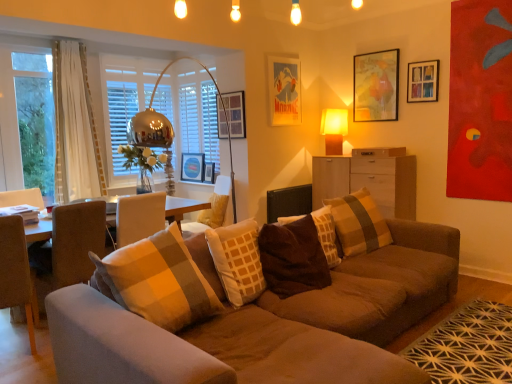
Locate an element on the screen. light brown wood cabinet at center right is located at coordinates (368, 181).

Describe the element at coordinates (284, 90) in the screenshot. This screenshot has width=512, height=384. I see `matte paper poster at upper center, arranged as the 4th picture frame when viewed from the left` at that location.

Locate an element on the screen. wooden map at upper right, acting as the 2th picture frame starting from the right is located at coordinates (376, 86).

What do you see at coordinates (27, 121) in the screenshot? The width and height of the screenshot is (512, 384). I see `transparent glass window at left` at bounding box center [27, 121].

Locate an element on the screen. light brown wood cabinet at center right is located at coordinates (368, 181).

Which is more to the left, wooden picture frame at upper right, the sixth picture frame when ordered from left to right, or brown fabric swivel chair at left?

Positioned to the left is brown fabric swivel chair at left.

Looking at this image, how far apart are wooden picture frame at upper right, the sixth picture frame when ordered from left to right, and brown fabric swivel chair at left?

The distance of wooden picture frame at upper right, the sixth picture frame when ordered from left to right, from brown fabric swivel chair at left is 11.20 feet.

From a real-world perspective, is wooden picture frame at upper right, the sixth picture frame when ordered from left to right, located higher than brown fabric swivel chair at left?

Yes.

Does wooden picture frame at upper right, the sixth picture frame when ordered from left to right, come behind brown fabric swivel chair at left?

Yes, it is behind brown fabric swivel chair at left.

Would you say wooden map at upper right, acting as the fifth picture frame starting from the left, is outside white sheer curtain at left?

Yes, wooden map at upper right, acting as the fifth picture frame starting from the left, is outside of white sheer curtain at left.

Which of these two, wooden map at upper right, acting as the fifth picture frame starting from the left, or white sheer curtain at left, stands taller?

white sheer curtain at left is taller.

From a real-world perspective, which picture frame is the 4th one above the white sheer curtain at left? Please provide its 2D coordinates.

[(376, 86)]

Is wooden map at upper right, acting as the fifth picture frame starting from the left, beside white sheer curtain at left?

No, wooden map at upper right, acting as the fifth picture frame starting from the left, is not with white sheer curtain at left.

Would you say light brown wood cabinet at center right is a long distance from transparent glass window at left?

Indeed, light brown wood cabinet at center right is not near transparent glass window at left.

Which of these two, light brown wood cabinet at center right or transparent glass window at left, stands taller?

transparent glass window at left.

From the image's perspective, is light brown wood cabinet at center right under transparent glass window at left?

Indeed, from the image's perspective, light brown wood cabinet at center right is shown beneath transparent glass window at left.

Is wooden map at upper right, acting as the fifth picture frame starting from the left, shorter than plaid fabric pillow at center, the third pillow viewed from the front?

In fact, wooden map at upper right, acting as the fifth picture frame starting from the left, may be taller than plaid fabric pillow at center, the third pillow viewed from the front.

Is wooden map at upper right, acting as the fifth picture frame starting from the left, looking in the opposite direction of plaid fabric pillow at center, the 1th pillow viewed from the back?

No, wooden map at upper right, acting as the fifth picture frame starting from the left, is not facing the opposite direction of plaid fabric pillow at center, the 1th pillow viewed from the back.

In terms of width, does wooden map at upper right, acting as the 2th picture frame starting from the right, look wider or thinner when compared to plaid fabric pillow at center, the third pillow viewed from the front?

Considering their sizes, wooden map at upper right, acting as the 2th picture frame starting from the right, looks slimmer than plaid fabric pillow at center, the third pillow viewed from the front.

Is point (362, 74) in front of point (364, 211)?

No, (362, 74) is further to viewer.

From a real-world perspective, who is located higher, beige fabric armchair at center or matte paper poster at upper center, which appears as the 3th picture frame when viewed from the right?

From a 3D spatial view, matte paper poster at upper center, which appears as the 3th picture frame when viewed from the right, is above.

Does beige fabric armchair at center have a larger size compared to matte paper poster at upper center, arranged as the 4th picture frame when viewed from the left?

Correct, beige fabric armchair at center is larger in size than matte paper poster at upper center, arranged as the 4th picture frame when viewed from the left.

Can you tell me how much beige fabric armchair at center and matte paper poster at upper center, arranged as the 4th picture frame when viewed from the left, differ in facing direction?

The facing directions of beige fabric armchair at center and matte paper poster at upper center, arranged as the 4th picture frame when viewed from the left, are 100 degrees apart.

Which object is closer to the camera taking this photo, beige fabric armchair at center or matte paper poster at upper center, which appears as the 3th picture frame when viewed from the right?

beige fabric armchair at center is in front.

Looking at the image, does matte orange table lamp at upper right seem bigger or smaller compared to plaid fabric pillow at center, the third pillow viewed from the front?

matte orange table lamp at upper right is smaller than plaid fabric pillow at center, the third pillow viewed from the front.

From a real-world perspective, who is located higher, matte orange table lamp at upper right or plaid fabric pillow at center, the third pillow viewed from the front?

matte orange table lamp at upper right.

Which object is closer to the camera, matte orange table lamp at upper right or plaid fabric pillow at center, the third pillow viewed from the front?

plaid fabric pillow at center, the third pillow viewed from the front, is in front.

From a real-world perspective, is matte paper poster at upper center, which appears as the 3th picture frame when viewed from the right, below white sheer curtain at left?

Actually, matte paper poster at upper center, which appears as the 3th picture frame when viewed from the right, is physically above white sheer curtain at left in the real world.

Is matte paper poster at upper center, which appears as the 3th picture frame when viewed from the right, positioned with its back to white sheer curtain at left?

No, white sheer curtain at left is not at the back of matte paper poster at upper center, which appears as the 3th picture frame when viewed from the right.

Which of these two, matte paper poster at upper center, arranged as the 4th picture frame when viewed from the left, or white sheer curtain at left, is bigger?

Bigger between the two is white sheer curtain at left.

From the image's perspective, who appears lower, matte paper poster at upper center, which appears as the 3th picture frame when viewed from the right, or white sheer curtain at left?

white sheer curtain at left is shown below in the image.

Identify the location of swivel chair lying below the wooden picture frame at upper right, the sixth picture frame when ordered from left to right (from the image's perspective). (69, 248).

This screenshot has width=512, height=384. Identify the location of picture frame that is the 5th object to the right of the white sheer curtain at left, starting at the anchor. [x=376, y=86].

Considering their positions, is beige fabric armchair at center positioned closer to light brown wood chair at left than metallic glass vase at left?

beige fabric armchair at center lies closer to light brown wood chair at left than the other object.

From the image, which object appears to be farther from beige fabric armchair at center, wooden map at upper right, acting as the fifth picture frame starting from the left, or wooden picture frame at upper center, marked as the 3th picture frame in a left-to-right arrangement?

wooden map at upper right, acting as the fifth picture frame starting from the left, is positioned further to the anchor beige fabric armchair at center.

Based on their spatial positions, is yellow glass lightbulbs at upper center or light brown wood chair at left closer to brownplush fabricpillow at center, which appears as the 2th pillow when viewed from the back?

Among the two, light brown wood chair at left is located nearer to brownplush fabricpillow at center, which appears as the 2th pillow when viewed from the back.

From the image, which object appears to be nearer to brownplush fabricpillow at center, which appears as the 2th pillow when viewed from the back, light brown wood chair at left or plaid fabric pillow at center, the third pillow viewed from the front?

plaid fabric pillow at center, the third pillow viewed from the front.

Considering their positions, is suede couch at center positioned closer to white wood drawer at center than wooden picture frame at upper center, marked as the 3th picture frame in a left-to-right arrangement?

Among the two, wooden picture frame at upper center, marked as the 3th picture frame in a left-to-right arrangement, is located nearer to white wood drawer at center.

Considering their positions, is brown fabric swivel chair at left positioned further to brownplush fabricpillow at center, which appears as the 2th pillow when viewed from the back, than wooden map at upper right, acting as the 2th picture frame starting from the right?

Based on the image, wooden map at upper right, acting as the 2th picture frame starting from the right, appears to be further to brownplush fabricpillow at center, which appears as the 2th pillow when viewed from the back.

From the picture: Estimate the real-world distances between objects in this image. Which object is further from beige fabric armchair at center, plaid fabric pillow at center, the 1th pillow viewed from the back, or white wood drawer at center?

white wood drawer at center lies further to beige fabric armchair at center than the other object.

Estimate the real-world distances between objects in this image. Which object is closer to brown fabric swivel chair at left, beige fabric armchair at center or matte orange table lamp at upper right?

Among the two, beige fabric armchair at center is located nearer to brown fabric swivel chair at left.

Where is `cabinetry between transparent glass window at left and wooden picture frame at upper right, the sixth picture frame when ordered from left to right, from left to right`? This screenshot has height=384, width=512. cabinetry between transparent glass window at left and wooden picture frame at upper right, the sixth picture frame when ordered from left to right, from left to right is located at coordinates (368, 181).

Where is `window screen between light brown wood chair at left and matte black picture frame at upper center, the 5th picture frame viewed from the right, along the z-axis`? window screen between light brown wood chair at left and matte black picture frame at upper center, the 5th picture frame viewed from the right, along the z-axis is located at coordinates (27, 121).

Identify the location of armchair situated between white sheer curtain at left and brownplush fabricpillow at center, which appears as the 2th pillow when viewed from the front, from left to right. The image size is (512, 384). (211, 209).

Find the location of `window between white sheer curtain at left and yellow glass lightbulbs at upper center in the horizontal direction`. window between white sheer curtain at left and yellow glass lightbulbs at upper center in the horizontal direction is located at coordinates (189, 112).